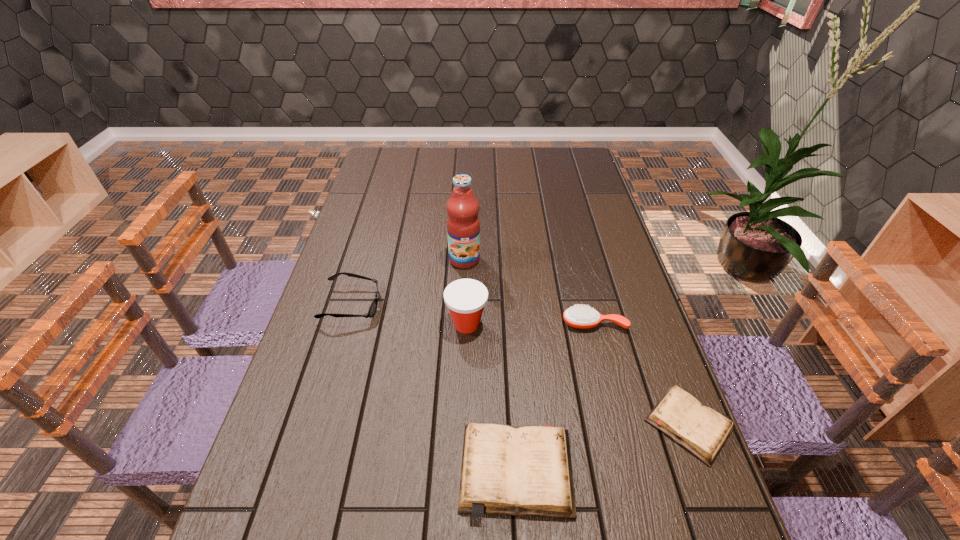
At what (x,y) coordinates should I click in order to perform the action: click on the taller diary. Please return your answer as a coordinate pair (x, y). Looking at the image, I should click on (520, 471).

Locate an element on the screen. This screenshot has width=960, height=540. the second shortest object is located at coordinates (520, 471).

Where is `the shorter diary`? the shorter diary is located at coordinates (701, 430).

What are the coordinates of `the shortest object` in the screenshot? It's located at (701, 430).

This screenshot has height=540, width=960. I want to click on the tallest object, so click(463, 225).

Identify the location of fruit juice. (463, 225).

This screenshot has width=960, height=540. I want to click on sunglasses, so click(x=373, y=307).

Identify the location of the second tallest object. (465, 298).

This screenshot has height=540, width=960. In order to click on hairbrush in this screenshot , I will do `click(578, 316)`.

The height and width of the screenshot is (540, 960). In order to click on vacant region located on the left of the taller diary in this screenshot , I will do `click(401, 471)`.